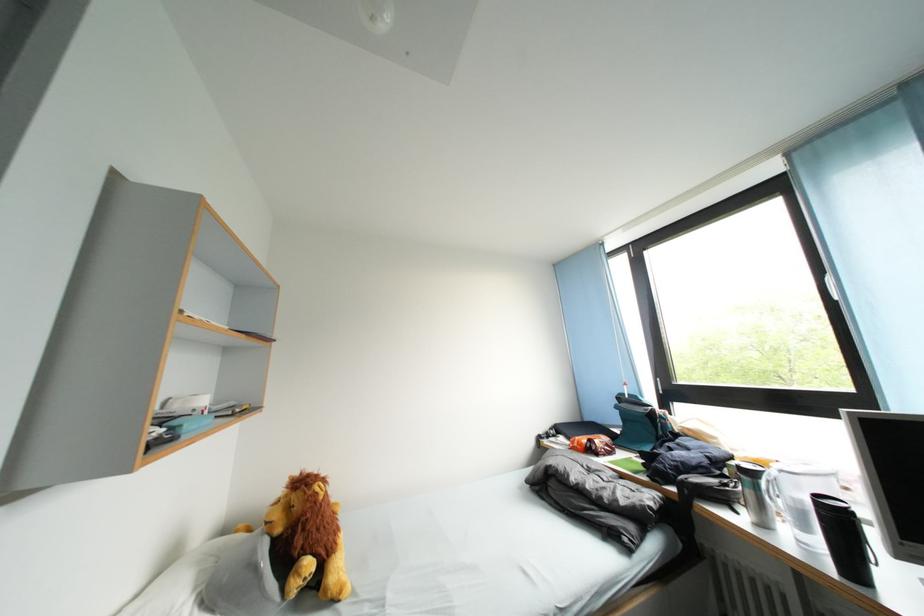
The height and width of the screenshot is (616, 924). Describe the element at coordinates (630, 320) in the screenshot. I see `the blind pull cord` at that location.